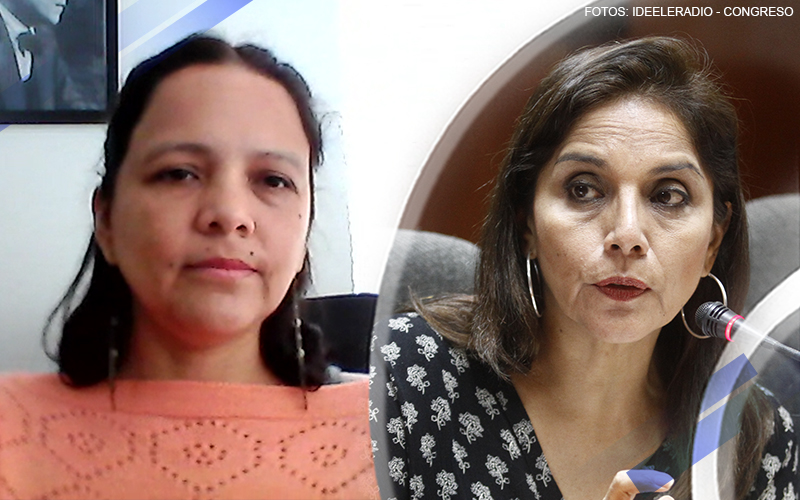
Identify the location of dark colored wall behind the woman on the right. Image resolution: width=800 pixels, height=500 pixels. (742, 60).